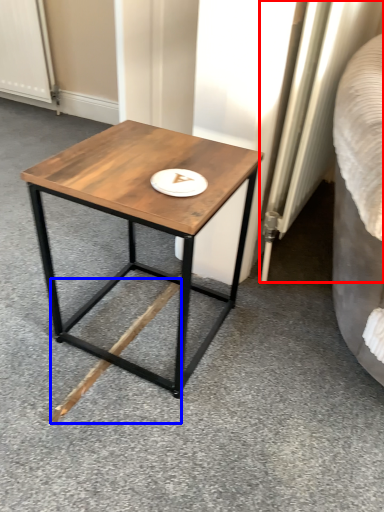
Question: Which of the following is the closest to the observer, radiator (highlighted by a red box) or wood (highlighted by a blue box)?

Choices:
 (A) radiator
 (B) wood

Answer: (A)